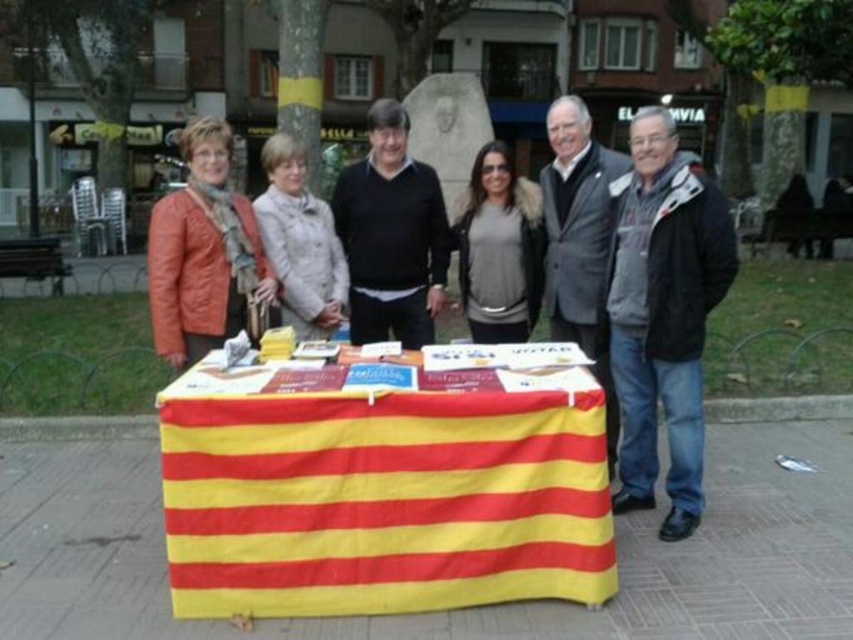
You are a photographer at the event and want to ensure that both the gray matte jacket at center and the light beige fabric coat at center are clearly visible in the photo. Since they are both at the center, which one is positioned higher and might be more noticeable?

The gray matte jacket at center is above the light beige fabric coat at center, making it more noticeable in the photo.